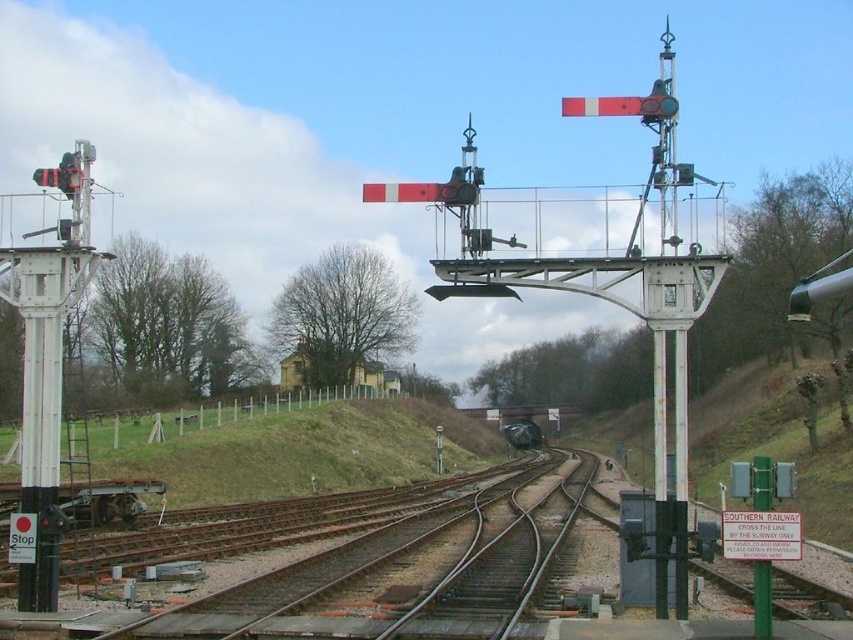
Is point (364, 611) positioned after point (506, 440)?

No, (364, 611) is closer to viewer.

Is brown metal train track at center closer to the viewer compared to metallic gray train at center?

That is True.

The height and width of the screenshot is (640, 853). In order to click on brown metal train track at center in this screenshot , I will do pyautogui.click(x=409, y=572).